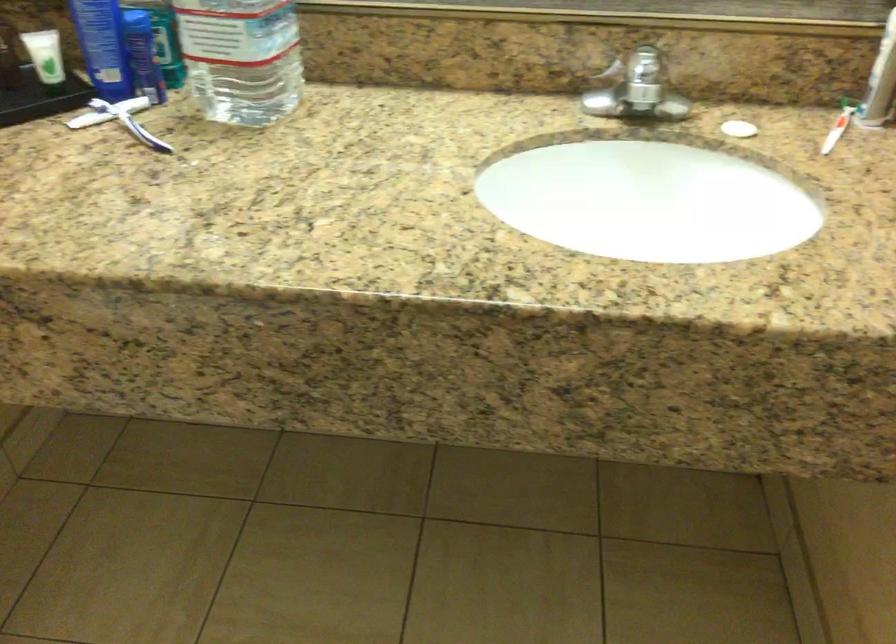
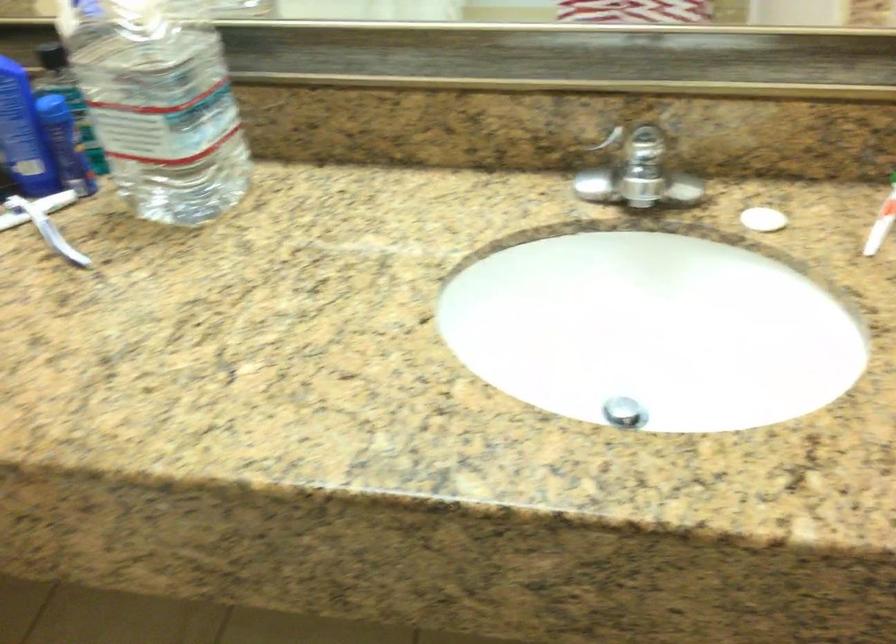
Question: The camera is either moving clockwise (left) or counter-clockwise (right) around the object. The first image is from the beginning of the video and the second image is from the end. Is the camera moving left or right when shooting the video?

Choices:
 (A) Left
 (B) Right

Answer: (B)